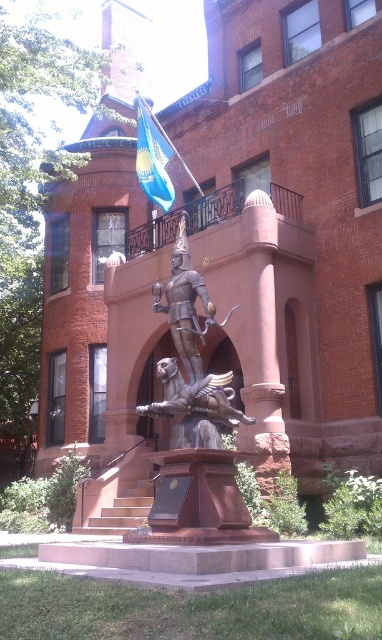
Does bronze/golden statue at center appear on the left side of blue fabric flag at upper center?

No, bronze/golden statue at center is not to the left of blue fabric flag at upper center.

How distant is bronze/golden statue at center from blue fabric flag at upper center?

bronze/golden statue at center is 20.37 meters away from blue fabric flag at upper center.

Is point (213, 433) farther from viewer compared to point (157, 154)?

No, (213, 433) is in front of (157, 154).

Locate an element on the screen. The image size is (382, 640). bronze/golden statue at center is located at coordinates (194, 406).

Between polished bronze statue at center and bronze/golden statue at center, which one has more height?

Standing taller between the two is polished bronze statue at center.

Does polished bronze statue at center appear under bronze/golden statue at center?

Actually, polished bronze statue at center is above bronze/golden statue at center.

Between point (184, 316) and point (191, 445), which one is positioned in front?

Point (191, 445)

What are the coordinates of `polished bronze statue at center` in the screenshot? It's located at (191, 358).

Does polished bronze statue at center appear on the right side of blue fabric flag at upper center?

Correct, you'll find polished bronze statue at center to the right of blue fabric flag at upper center.

Does point (208, 304) come in front of point (139, 136)?

That is True.

What are the coordinates of `polished bronze statue at center` in the screenshot? It's located at (191, 358).